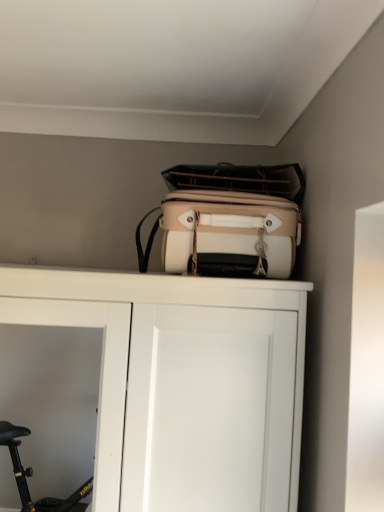
Question: Considering the relative positions of white matte cupboard at upper center and beige fabric suitcase at upper center in the image provided, is white matte cupboard at upper center behind beige fabric suitcase at upper center?

Choices:
 (A) no
 (B) yes

Answer: (A)

Question: From a real-world perspective, is white matte cupboard at upper center positioned under beige fabric suitcase at upper center based on gravity?

Choices:
 (A) yes
 (B) no

Answer: (A)

Question: Is beige fabric suitcase at upper center inside white matte cupboard at upper center?

Choices:
 (A) yes
 (B) no

Answer: (B)

Question: Can you confirm if white matte cupboard at upper center is positioned to the right of beige fabric suitcase at upper center?

Choices:
 (A) no
 (B) yes

Answer: (A)

Question: Does white matte cupboard at upper center appear on the left side of beige fabric suitcase at upper center?

Choices:
 (A) no
 (B) yes

Answer: (B)

Question: Does white matte cupboard at upper center have a lesser height compared to beige fabric suitcase at upper center?

Choices:
 (A) yes
 (B) no

Answer: (B)

Question: Does beige fabric suitcase at upper center have a greater height compared to white matte cupboard at upper center?

Choices:
 (A) yes
 (B) no

Answer: (B)

Question: Could you tell me if beige fabric suitcase at upper center is turned towards white matte cupboard at upper center?

Choices:
 (A) yes
 (B) no

Answer: (B)

Question: Can you confirm if beige fabric suitcase at upper center is positioned to the left of white matte cupboard at upper center?

Choices:
 (A) no
 (B) yes

Answer: (A)

Question: Does beige fabric suitcase at upper center come in front of white matte cupboard at upper center?

Choices:
 (A) no
 (B) yes

Answer: (A)

Question: Is beige fabric suitcase at upper center behind white matte cupboard at upper center?

Choices:
 (A) yes
 (B) no

Answer: (A)

Question: From a real-world perspective, does beige fabric suitcase at upper center sit lower than white matte cupboard at upper center?

Choices:
 (A) no
 (B) yes

Answer: (A)

Question: In the image, is beige fabric suitcase at upper center positioned in front of or behind white matte cupboard at upper center?

Choices:
 (A) front
 (B) behind

Answer: (B)